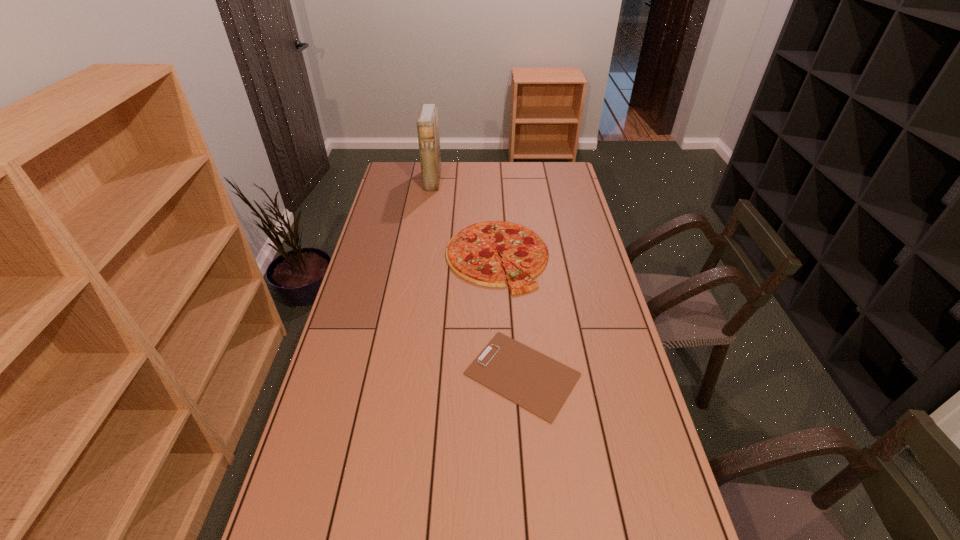
What are the coordinates of `object present at the right edge` in the screenshot? It's located at (530, 379).

Image resolution: width=960 pixels, height=540 pixels. What are the coordinates of `free space at the far edge` in the screenshot? It's located at (474, 185).

Find the location of a particular element. The width and height of the screenshot is (960, 540). vacant region at the left edge of the desktop is located at coordinates (353, 431).

What are the coordinates of `vacant space at the right edge of the desktop` in the screenshot? It's located at (571, 265).

Where is `vacant space that's between the clipboard and the second farthest object`? vacant space that's between the clipboard and the second farthest object is located at coordinates (510, 315).

Locate an element on the screen. The height and width of the screenshot is (540, 960). unoccupied area between the tallest object and the second farthest object is located at coordinates (465, 218).

The height and width of the screenshot is (540, 960). In order to click on empty space that is in between the second nearest object and the leftmost object in this screenshot , I will do `click(465, 218)`.

Find the location of `object identified as the second closest to the clipboard`. object identified as the second closest to the clipboard is located at coordinates (427, 123).

Locate which object is the closest to the shortest object. Please provide its 2D coordinates. Your answer should be formatted as a tuple, i.e. [(x, y)], where the tuple contains the x and y coordinates of a point satisfying the conditions above.

[(472, 253)]

Find the location of a particular element. The height and width of the screenshot is (540, 960). free region that satisfies the following two spatial constraints: 1. on the cover of the farthest object; 2. on the left side of the nearest object is located at coordinates (402, 374).